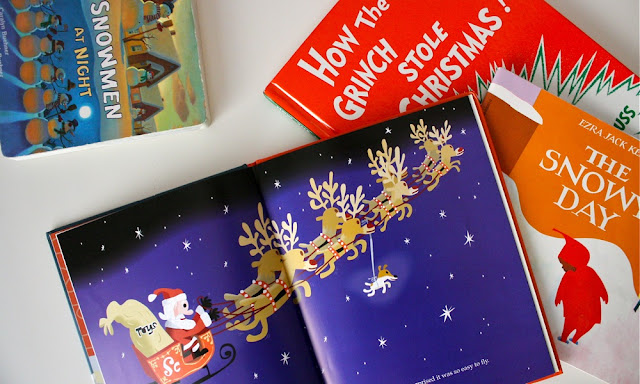
Identify the location of opened book. The height and width of the screenshot is (384, 640). (193, 247).